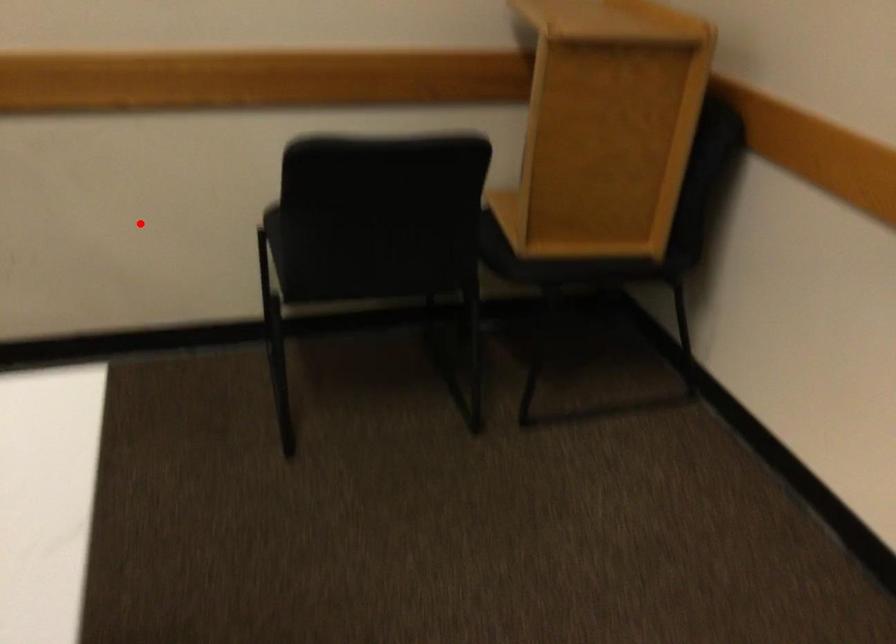
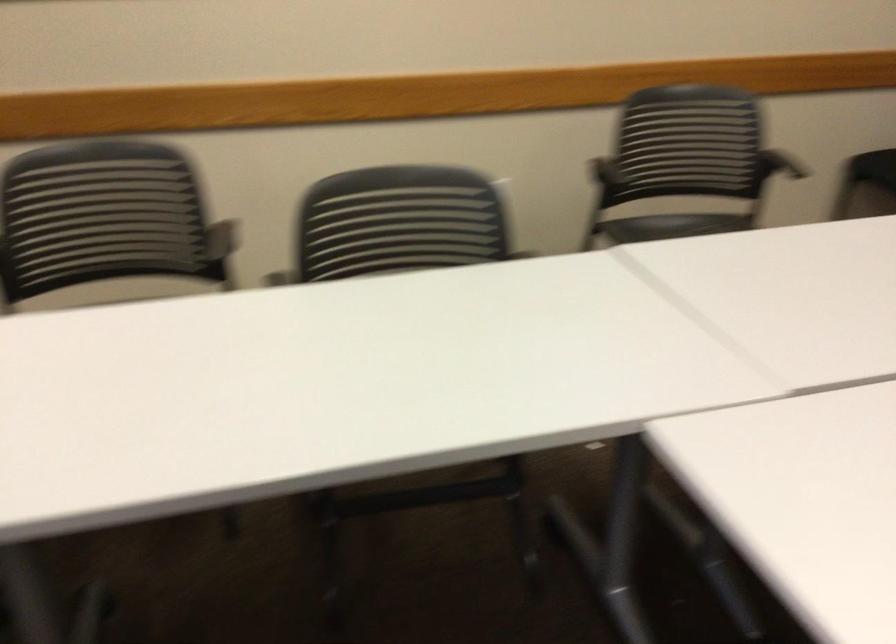
Find the pixel in the second image that matches the highlighted location in the first image.

(790, 166)